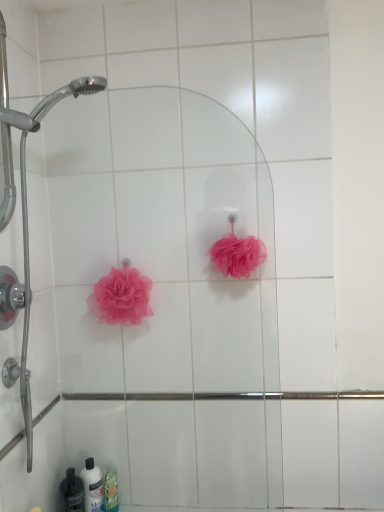
Describe the element at coordinates (237, 255) in the screenshot. I see `pink mesh sponge at center, which is counted as the first rose, starting from the right` at that location.

The height and width of the screenshot is (512, 384). What do you see at coordinates (72, 492) in the screenshot? I see `translucent plastic bottle at lower left, the 1th toiletry in the left-to-right sequence` at bounding box center [72, 492].

Measure the distance between point (107, 480) and camera.

The depth of point (107, 480) is 1.55 meters.

Describe the element at coordinates (111, 490) in the screenshot. The height and width of the screenshot is (512, 384). I see `green matte soap at lower left, the third toiletry in the left-to-right sequence` at that location.

Image resolution: width=384 pixels, height=512 pixels. Find the location of `pink mesh sponge at upper center`. pink mesh sponge at upper center is located at coordinates (162, 239).

Which of these two, green matte soap at lower left, the third toiletry in the left-to-right sequence, or pink mesh sponge at lower left, marked as the 1th rose in a left-to-right arrangement, is wider?

Wider between the two is pink mesh sponge at lower left, marked as the 1th rose in a left-to-right arrangement.

From the image's perspective, which one is positioned higher, green matte soap at lower left, marked as the 1th toiletry in a right-to-left arrangement, or pink mesh sponge at lower left, which appears as the 2th rose when viewed from the right?

pink mesh sponge at lower left, which appears as the 2th rose when viewed from the right, appears higher in the image.

Identify the location of toiletry that is the 3rd object directly below the pink mesh sponge at lower left, marked as the 1th rose in a left-to-right arrangement (from a real-world perspective). point(111,490).

Is green matte soap at lower left, the third toiletry in the left-to-right sequence, oriented towards pink mesh sponge at lower left, marked as the 1th rose in a left-to-right arrangement?

No, green matte soap at lower left, the third toiletry in the left-to-right sequence, does not turn towards pink mesh sponge at lower left, marked as the 1th rose in a left-to-right arrangement.

From the image's perspective, relative to white glossy bottle at lower left, which is the second toiletry in right-to-left order, is translucent plastic bottle at lower left, acting as the third toiletry starting from the right, above or below?

translucent plastic bottle at lower left, acting as the third toiletry starting from the right, is situated lower than white glossy bottle at lower left, which is the second toiletry in right-to-left order, in the image.

Is translucent plastic bottle at lower left, the 1th toiletry in the left-to-right sequence, to the left of white glossy bottle at lower left, which is the 2th toiletry in left-to-right order, from the viewer's perspective?

Yes.

Considering the relative sizes of translucent plastic bottle at lower left, acting as the third toiletry starting from the right, and white glossy bottle at lower left, which is the second toiletry in right-to-left order, in the image provided, is translucent plastic bottle at lower left, acting as the third toiletry starting from the right, wider than white glossy bottle at lower left, which is the second toiletry in right-to-left order,?

Indeed, translucent plastic bottle at lower left, acting as the third toiletry starting from the right, has a greater width compared to white glossy bottle at lower left, which is the second toiletry in right-to-left order.

Considering the sizes of objects translucent plastic bottle at lower left, the 1th toiletry in the left-to-right sequence, and white glossy bottle at lower left, which is the second toiletry in right-to-left order, in the image provided, who is bigger, translucent plastic bottle at lower left, the 1th toiletry in the left-to-right sequence, or white glossy bottle at lower left, which is the second toiletry in right-to-left order,?

With larger size is translucent plastic bottle at lower left, the 1th toiletry in the left-to-right sequence.

From a real-world perspective, which toiletry is the 3rd one underneath the pink mesh sponge at center, the 2th rose viewed from the left? Please provide its 2D coordinates.

[(111, 490)]

Is point (115, 482) closer or farther from the camera than point (228, 262)?

Point (115, 482) appears to be farther away from the viewer than point (228, 262).

Looking at their sizes, would you say green matte soap at lower left, marked as the 1th toiletry in a right-to-left arrangement, is wider or thinner than pink mesh sponge at center, the 2th rose viewed from the left?

Clearly, green matte soap at lower left, marked as the 1th toiletry in a right-to-left arrangement, has less width compared to pink mesh sponge at center, the 2th rose viewed from the left.

From the image's perspective, which is above, green matte soap at lower left, marked as the 1th toiletry in a right-to-left arrangement, or pink mesh sponge at center, which is counted as the first rose, starting from the right?

pink mesh sponge at center, which is counted as the first rose, starting from the right, is shown above in the image.

From a real-world perspective, which is physically above, translucent plastic bottle at lower left, the 1th toiletry in the left-to-right sequence, or green matte soap at lower left, marked as the 1th toiletry in a right-to-left arrangement?

translucent plastic bottle at lower left, the 1th toiletry in the left-to-right sequence.

Would you say translucent plastic bottle at lower left, acting as the third toiletry starting from the right, is to the left or to the right of green matte soap at lower left, marked as the 1th toiletry in a right-to-left arrangement, in the picture?

From the image, it's evident that translucent plastic bottle at lower left, acting as the third toiletry starting from the right, is to the left of green matte soap at lower left, marked as the 1th toiletry in a right-to-left arrangement.

Is translucent plastic bottle at lower left, the 1th toiletry in the left-to-right sequence, oriented towards green matte soap at lower left, marked as the 1th toiletry in a right-to-left arrangement?

No, translucent plastic bottle at lower left, the 1th toiletry in the left-to-right sequence, is not oriented towards green matte soap at lower left, marked as the 1th toiletry in a right-to-left arrangement.

Which is behind, translucent plastic bottle at lower left, acting as the third toiletry starting from the right, or green matte soap at lower left, the third toiletry in the left-to-right sequence?

green matte soap at lower left, the third toiletry in the left-to-right sequence, is more distant.

Can green matte soap at lower left, marked as the 1th toiletry in a right-to-left arrangement, be found inside pink mesh sponge at upper center?

No, green matte soap at lower left, marked as the 1th toiletry in a right-to-left arrangement, is not a part of pink mesh sponge at upper center.

Considering the sizes of objects pink mesh sponge at upper center and green matte soap at lower left, marked as the 1th toiletry in a right-to-left arrangement, in the image provided, who is smaller, pink mesh sponge at upper center or green matte soap at lower left, marked as the 1th toiletry in a right-to-left arrangement,?

green matte soap at lower left, marked as the 1th toiletry in a right-to-left arrangement, is smaller.

Is point (239, 158) more distant than point (110, 472)?

No, it is in front of (110, 472).

From the image's perspective, which object appears higher, pink mesh sponge at upper center or green matte soap at lower left, marked as the 1th toiletry in a right-to-left arrangement?

pink mesh sponge at upper center.

Is pink mesh sponge at lower left, which appears as the 2th rose when viewed from the right, oriented away from green matte soap at lower left, the third toiletry in the left-to-right sequence?

No, pink mesh sponge at lower left, which appears as the 2th rose when viewed from the right,'s orientation is not away from green matte soap at lower left, the third toiletry in the left-to-right sequence.

Does pink mesh sponge at lower left, which appears as the 2th rose when viewed from the right, have a greater width compared to green matte soap at lower left, marked as the 1th toiletry in a right-to-left arrangement?

Correct, the width of pink mesh sponge at lower left, which appears as the 2th rose when viewed from the right, exceeds that of green matte soap at lower left, marked as the 1th toiletry in a right-to-left arrangement.

From a real-world perspective, is pink mesh sponge at lower left, marked as the 1th rose in a left-to-right arrangement, above or below green matte soap at lower left, the third toiletry in the left-to-right sequence?

Clearly, from a real-world perspective, pink mesh sponge at lower left, marked as the 1th rose in a left-to-right arrangement, is above green matte soap at lower left, the third toiletry in the left-to-right sequence.

Is the surface of pink mesh sponge at lower left, which appears as the 2th rose when viewed from the right, in direct contact with green matte soap at lower left, the third toiletry in the left-to-right sequence?

No.

Is translucent plastic bottle at lower left, acting as the third toiletry starting from the right, at the back of pink mesh sponge at center, the 2th rose viewed from the left?

No, pink mesh sponge at center, the 2th rose viewed from the left, is not facing away from translucent plastic bottle at lower left, acting as the third toiletry starting from the right.

How far apart are pink mesh sponge at center, which is counted as the first rose, starting from the right, and translucent plastic bottle at lower left, acting as the third toiletry starting from the right?

pink mesh sponge at center, which is counted as the first rose, starting from the right, and translucent plastic bottle at lower left, acting as the third toiletry starting from the right, are 1.19 meters apart.

What's the angular difference between pink mesh sponge at center, the 2th rose viewed from the left, and translucent plastic bottle at lower left, acting as the third toiletry starting from the right,'s facing directions?

52.1 degrees.

Which object is thinner, pink mesh sponge at center, which is counted as the first rose, starting from the right, or translucent plastic bottle at lower left, the 1th toiletry in the left-to-right sequence?

Thinner between the two is translucent plastic bottle at lower left, the 1th toiletry in the left-to-right sequence.

Find the location of `the 3rd toiletry behind the pink mesh sponge at lower left, which appears as the 2th rose when viewed from the right, starting your count from the anchor`. the 3rd toiletry behind the pink mesh sponge at lower left, which appears as the 2th rose when viewed from the right, starting your count from the anchor is located at coordinates (111, 490).

Identify the location of toiletry positioned vertically above the translucent plastic bottle at lower left, the 1th toiletry in the left-to-right sequence (from a real-world perspective). The width and height of the screenshot is (384, 512). (92, 486).

Considering their positions, is pink mesh sponge at lower left, marked as the 1th rose in a left-to-right arrangement, positioned further to pink mesh sponge at center, which is counted as the first rose, starting from the right, than green matte soap at lower left, marked as the 1th toiletry in a right-to-left arrangement?

green matte soap at lower left, marked as the 1th toiletry in a right-to-left arrangement, lies further to pink mesh sponge at center, which is counted as the first rose, starting from the right, than the other object.

Based on their spatial positions, is pink mesh sponge at upper center or pink mesh sponge at lower left, marked as the 1th rose in a left-to-right arrangement, further from green matte soap at lower left, the third toiletry in the left-to-right sequence?

pink mesh sponge at lower left, marked as the 1th rose in a left-to-right arrangement, is further to green matte soap at lower left, the third toiletry in the left-to-right sequence.

Considering their positions, is pink mesh sponge at center, the 2th rose viewed from the left, positioned closer to translucent plastic bottle at lower left, acting as the third toiletry starting from the right, than white glossy bottle at lower left, which is the second toiletry in right-to-left order?

white glossy bottle at lower left, which is the second toiletry in right-to-left order, is closer to translucent plastic bottle at lower left, acting as the third toiletry starting from the right.

Which object lies further to the anchor point green matte soap at lower left, marked as the 1th toiletry in a right-to-left arrangement, translucent plastic bottle at lower left, the 1th toiletry in the left-to-right sequence, or white glossy bottle at lower left, which is the 2th toiletry in left-to-right order?

translucent plastic bottle at lower left, the 1th toiletry in the left-to-right sequence, is positioned further to the anchor green matte soap at lower left, marked as the 1th toiletry in a right-to-left arrangement.

Estimate the real-world distances between objects in this image. Which object is closer to green matte soap at lower left, the third toiletry in the left-to-right sequence, translucent plastic bottle at lower left, the 1th toiletry in the left-to-right sequence, or pink mesh sponge at center, the 2th rose viewed from the left?

translucent plastic bottle at lower left, the 1th toiletry in the left-to-right sequence, is positioned closer to the anchor green matte soap at lower left, the third toiletry in the left-to-right sequence.

In the scene shown: Estimate the real-world distances between objects in this image. Which object is further from white glossy bottle at lower left, which is the second toiletry in right-to-left order, green matte soap at lower left, the third toiletry in the left-to-right sequence, or translucent plastic bottle at lower left, the 1th toiletry in the left-to-right sequence?

The object further to white glossy bottle at lower left, which is the second toiletry in right-to-left order, is translucent plastic bottle at lower left, the 1th toiletry in the left-to-right sequence.

Which object lies further to the anchor point pink mesh sponge at center, which is counted as the first rose, starting from the right, pink mesh sponge at upper center or green matte soap at lower left, the third toiletry in the left-to-right sequence?

Based on the image, green matte soap at lower left, the third toiletry in the left-to-right sequence, appears to be further to pink mesh sponge at center, which is counted as the first rose, starting from the right.

Estimate the real-world distances between objects in this image. Which object is further from translucent plastic bottle at lower left, acting as the third toiletry starting from the right, pink mesh sponge at lower left, marked as the 1th rose in a left-to-right arrangement, or pink mesh sponge at center, the 2th rose viewed from the left?

The object further to translucent plastic bottle at lower left, acting as the third toiletry starting from the right, is pink mesh sponge at center, the 2th rose viewed from the left.

Locate an element on the screen. toiletry between pink mesh sponge at center, which is counted as the first rose, starting from the right, and translucent plastic bottle at lower left, the 1th toiletry in the left-to-right sequence, vertically is located at coordinates (92, 486).

Image resolution: width=384 pixels, height=512 pixels. I want to click on toiletry between translucent plastic bottle at lower left, acting as the third toiletry starting from the right, and green matte soap at lower left, marked as the 1th toiletry in a right-to-left arrangement, from left to right, so click(92, 486).

This screenshot has width=384, height=512. I want to click on toiletry between pink mesh sponge at lower left, marked as the 1th rose in a left-to-right arrangement, and translucent plastic bottle at lower left, acting as the third toiletry starting from the right, vertically, so click(x=92, y=486).

Identify the location of mirror between pink mesh sponge at center, which is counted as the first rose, starting from the right, and green matte soap at lower left, the third toiletry in the left-to-right sequence, from top to bottom. (162, 239).